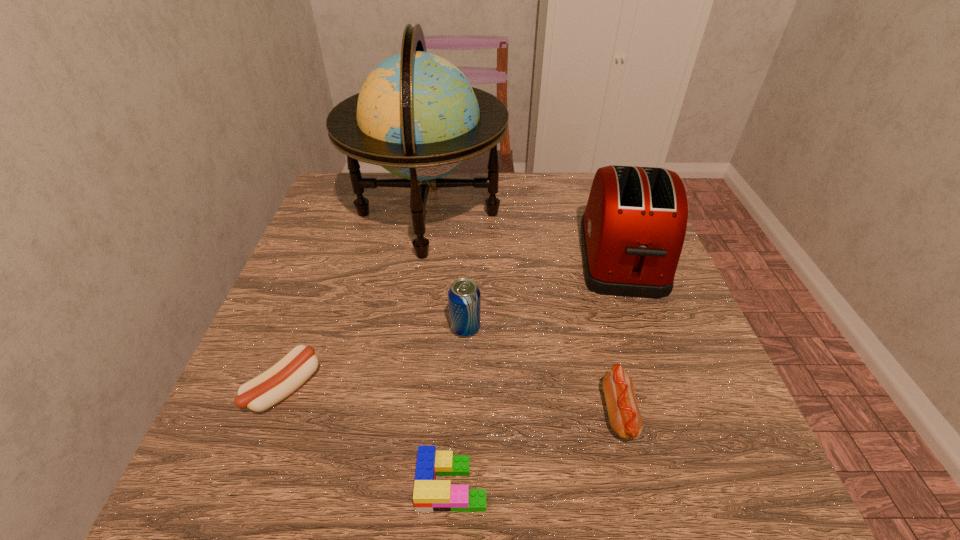
Locate an element on the screen. The width and height of the screenshot is (960, 540). globe is located at coordinates (416, 115).

Where is `the fifth shortest object`? This screenshot has height=540, width=960. the fifth shortest object is located at coordinates (632, 231).

Find the location of a particular element. The width and height of the screenshot is (960, 540). beer can is located at coordinates (464, 295).

Identify the location of the third farthest object. The width and height of the screenshot is (960, 540). (464, 295).

The width and height of the screenshot is (960, 540). What are the coordinates of `the right sausage` in the screenshot? It's located at (625, 419).

This screenshot has width=960, height=540. Identify the location of the left sausage. (275, 384).

Find the location of a particular element. Lego is located at coordinates (430, 495).

Locate an element on the screen. The image size is (960, 540). vacant space located 0.300m on the surface of the globe is located at coordinates pos(619,214).

Locate an element on the screen. This screenshot has width=960, height=540. vacant space situated on the front of the toaster is located at coordinates (659, 360).

This screenshot has width=960, height=540. I want to click on vacant area situated on the front of the beer can, so click(465, 365).